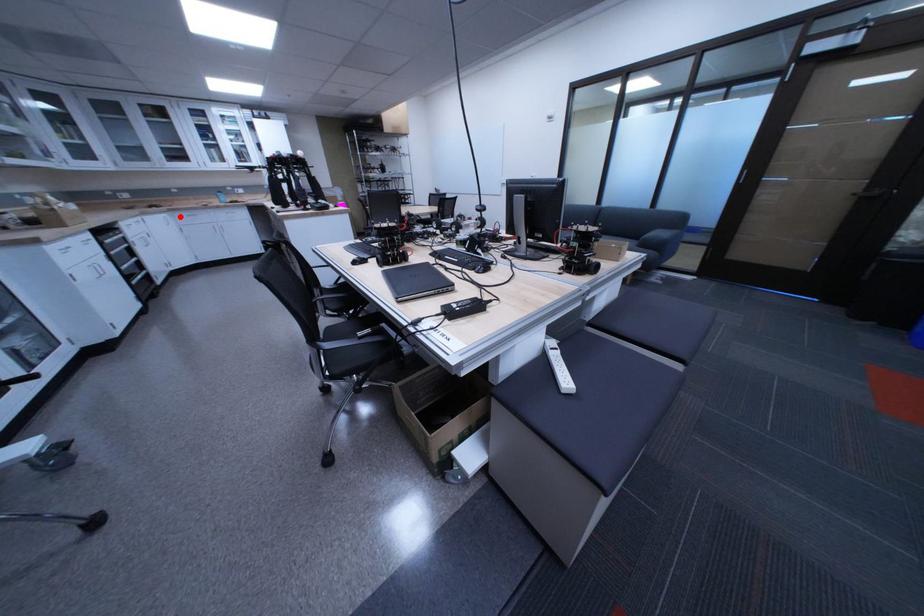
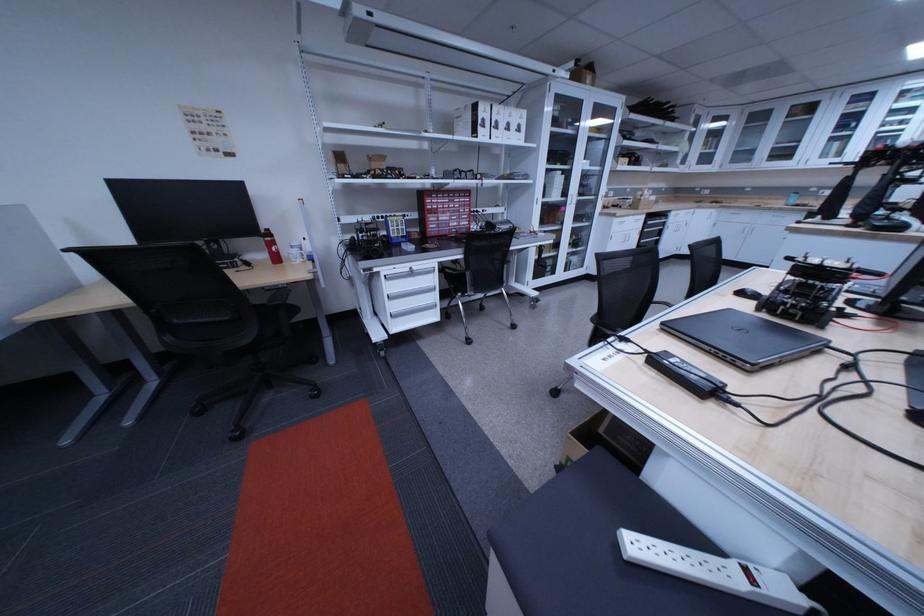
In the second image, find the point that corresponds to the highlighted location in the first image.

(728, 212)